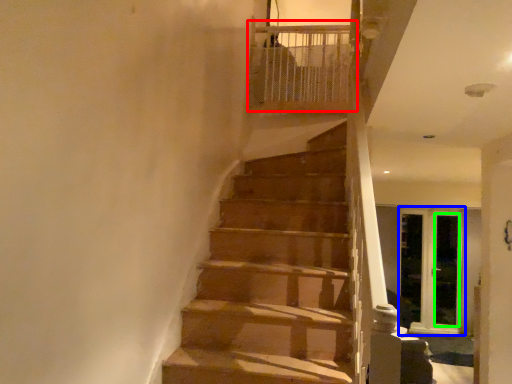
Question: Based on their relative distances, which object is farther from balustrade (highlighted by a red box)? Choose from screen door (highlighted by a blue box) and screen door (highlighted by a green box).

Choices:
 (A) screen door
 (B) screen door

Answer: (B)